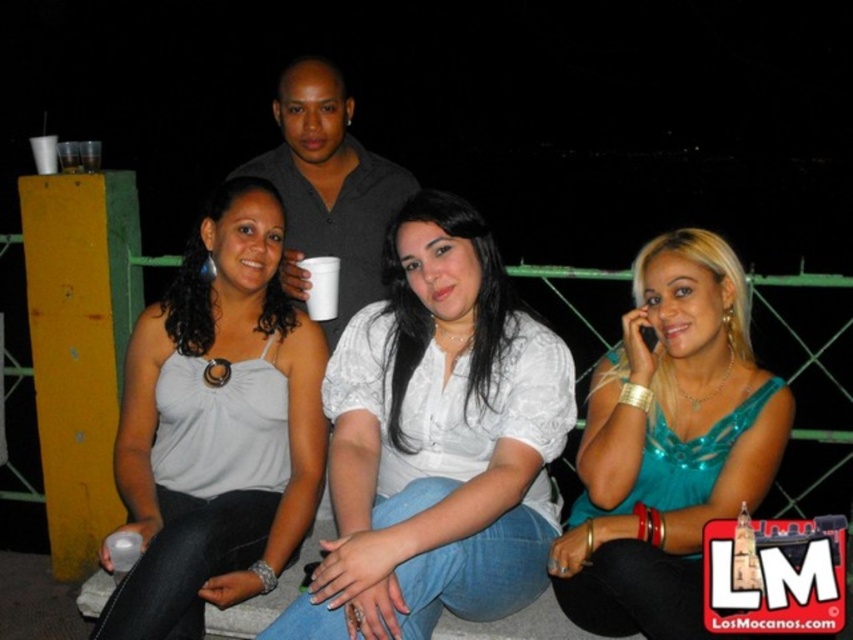
You are a photographer trying to capture a clear shot of the teal satin blouse at center from your current position. Given that the camera requires the subject to be within 2 meters for optimal focus, will you be able to achieve this?

The teal satin blouse at center is 1.91 meters away from camera, so yes, the photographer can achieve optimal focus since the distance is within the required 2 meters.

You are a photographer trying to capture a closeup of both the white lace blouse at center and the teal satin blouse at center in the image. Given that your camera can only focus on objects within a 30 cm range, will you be able to capture both blouses in a single focused shot?

The white lace blouse at center and teal satin blouse at center are 35.65 centimeters apart from each other. Since the distance between them exceeds the camera focus range of 30 cm, you will not be able to capture both blouses in a single focused shot.

You are a photographer trying to capture a closeup of the teal satin blouse at center. Based on the coordinates provided, where should you focus your camera lens?

The teal satin blouse at center is located at coordinates point (668, 444), so you should focus your camera lens at that point to capture a closeup.